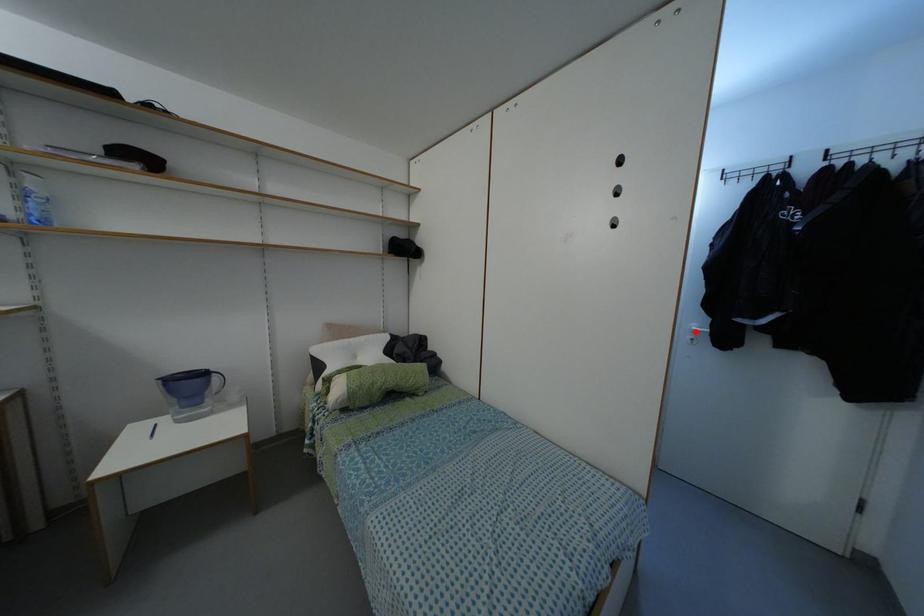
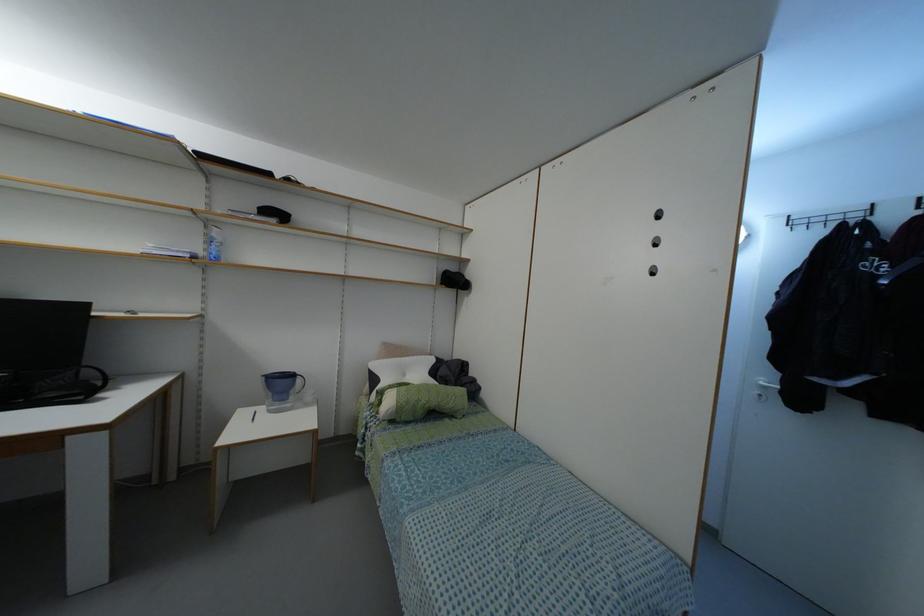
Where in the second image is the point corresponding to the highlighted location from the first image?

(763, 387)